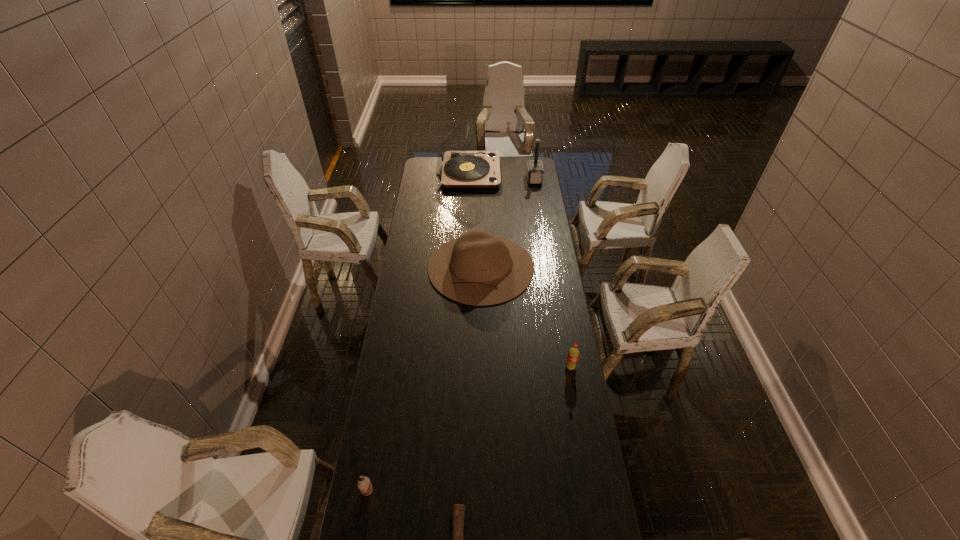
Where is `free area in between the fourth nearest object and the farther hammer`? The height and width of the screenshot is (540, 960). free area in between the fourth nearest object and the farther hammer is located at coordinates (508, 223).

I want to click on vacant point located between the sombrero and the tallest object, so click(x=475, y=220).

Where is `free spot between the fifth farthest object and the soda`? The image size is (960, 540). free spot between the fifth farthest object and the soda is located at coordinates (468, 429).

Identify the location of unoccupied position between the fifth farthest object and the taller hammer. (451, 335).

This screenshot has width=960, height=540. I want to click on vacant region between the fifth tallest object and the third farthest object, so click(424, 379).

Locate an element on the screen. the fourth closest object to the third shortest object is located at coordinates (456, 168).

In order to click on the third closest object to the soda in this screenshot , I will do `click(364, 484)`.

Identify the location of free spot that satisfies the following two spatial constraints: 1. with the tonearm facing the front of the tallest object; 2. on the left side of the fourth shortest object. (466, 267).

The image size is (960, 540). Find the location of `free location that satisfies the following two spatial constraints: 1. for striking with the head of the taller hammer; 2. on the back side of the fourth tallest object`. free location that satisfies the following two spatial constraints: 1. for striking with the head of the taller hammer; 2. on the back side of the fourth tallest object is located at coordinates (x=564, y=367).

Where is `free spot that satisfies the following two spatial constraints: 1. for striking with the head of the right hammer; 2. on the back side of the fourth tallest object`? The height and width of the screenshot is (540, 960). free spot that satisfies the following two spatial constraints: 1. for striking with the head of the right hammer; 2. on the back side of the fourth tallest object is located at coordinates (564, 367).